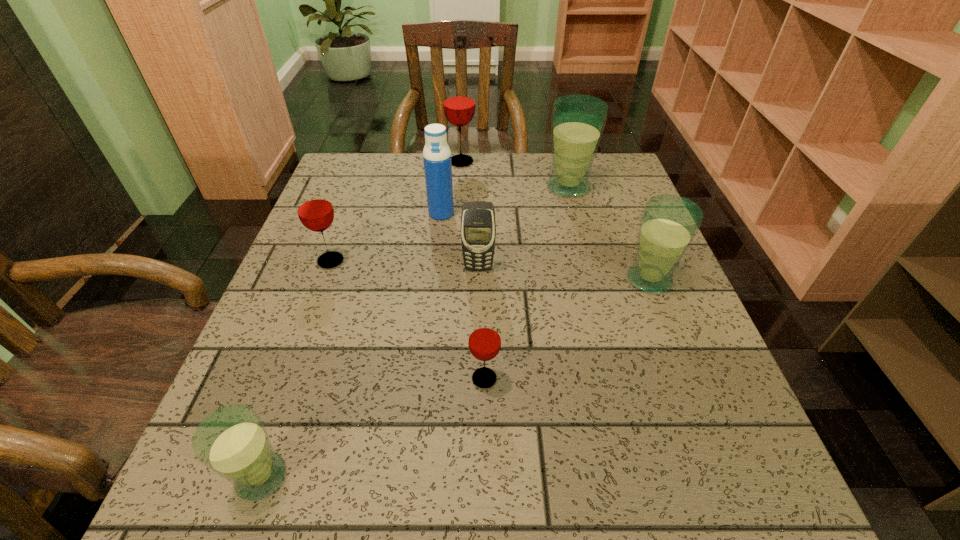
Where is `cellular telephone`? The image size is (960, 540). cellular telephone is located at coordinates (478, 228).

Find the location of a particular element. The width and height of the screenshot is (960, 540). the second nearest object is located at coordinates (484, 341).

Find the location of `the nearest red glass`. the nearest red glass is located at coordinates (484, 341).

Locate an element on the screen. The image size is (960, 540). the nearest object is located at coordinates (232, 441).

The width and height of the screenshot is (960, 540). Identify the location of the nearest blue glass. (232, 441).

Identify the location of free space located on the left of the farthest red glass. The image size is (960, 540). (415, 161).

Image resolution: width=960 pixels, height=540 pixels. What are the coordinates of `free space located 0.060m on the right of the second object from right to left` in the screenshot? It's located at (614, 187).

Find the location of a particular element. The width and height of the screenshot is (960, 540). vacant region located 0.140m on the front of the third farthest object is located at coordinates (437, 259).

Where is `free space located on the back of the second nearest red glass`? The width and height of the screenshot is (960, 540). free space located on the back of the second nearest red glass is located at coordinates (346, 219).

Where is `vacant space situated 0.050m on the back of the second biggest blue glass`? The height and width of the screenshot is (540, 960). vacant space situated 0.050m on the back of the second biggest blue glass is located at coordinates (636, 248).